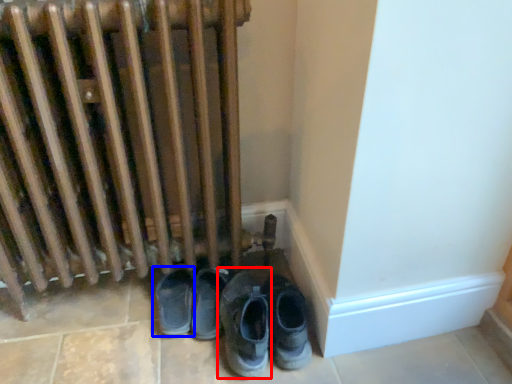
Question: Which object is closer to the camera taking this photo, footwear (highlighted by a red box) or footwear (highlighted by a blue box)?

Choices:
 (A) footwear
 (B) footwear

Answer: (A)